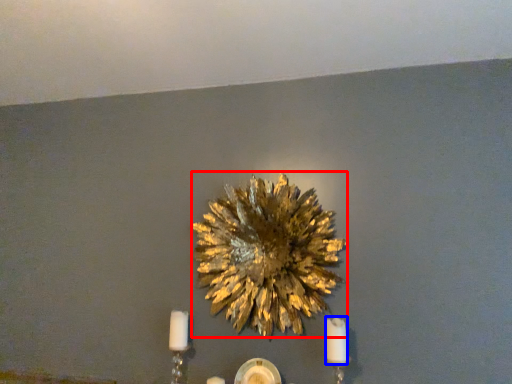
Question: Which object appears closest to the camera in this image, flower (highlighted by a red box) or candle (highlighted by a blue box)?

Choices:
 (A) flower
 (B) candle

Answer: (B)